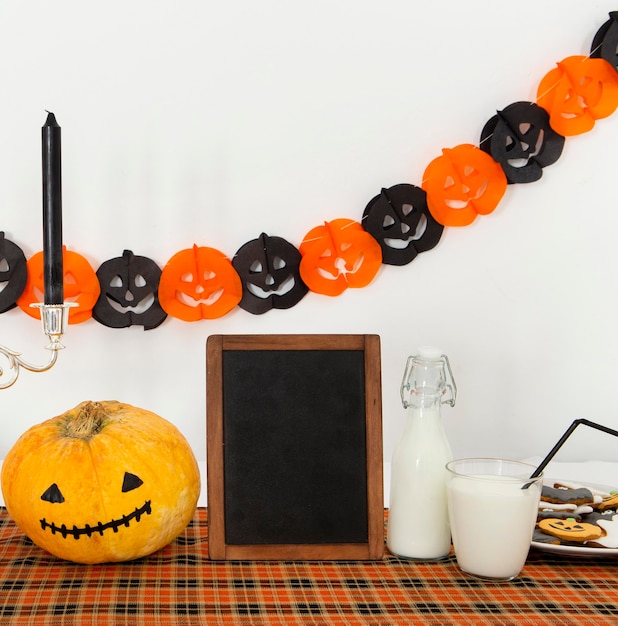
Where is `candle`? The image size is (618, 626). candle is located at coordinates (54, 188).